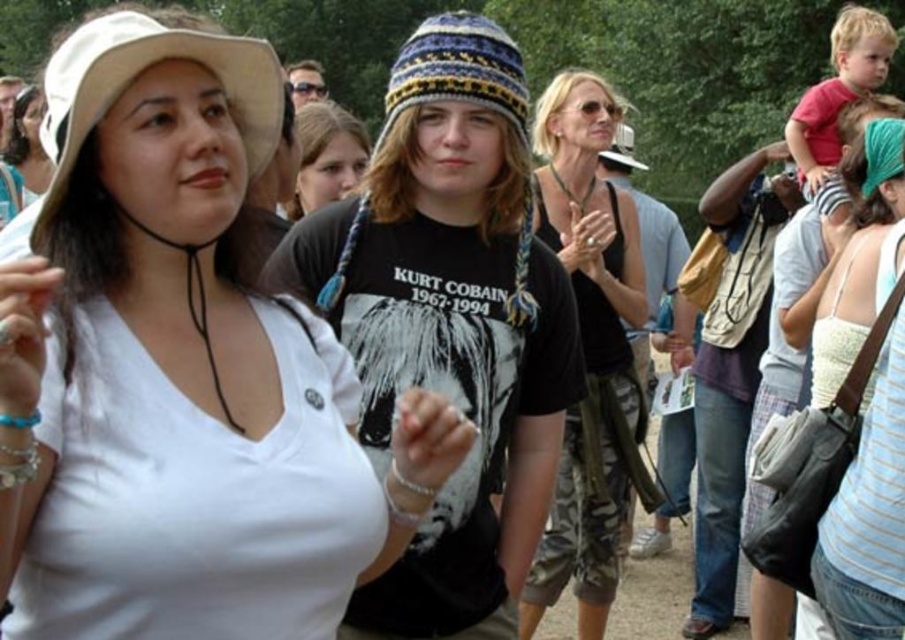
Looking at this image, you are at a festival and want to buy a souvenir. The vendor tells you that the price of the souvenir depends on the width of the clothing items you are wearing. The wider item costs more. Which clothing item between the black matte tank top at center and the red cotton shirt at upper right should you choose to pay less?

The black matte tank top at center has a smaller width than the red cotton shirt at upper right, so choosing the black matte tank top at center would result in paying less.

Consider the image. You are standing in the crowd at the festival and want to move closer to the two points marked in the image. Which point, point (591,289) or point (836,564), would you reach first if you walk straight ahead?

You would reach point (591,289) first because it is closer to you than point (836,564), which is further away.